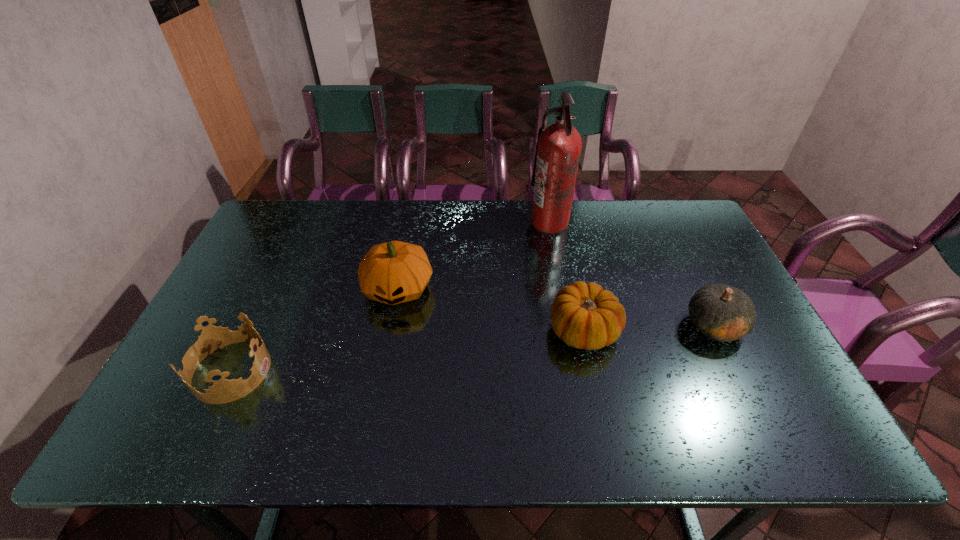
What are the coordinates of `free spot located 0.150m on the side of the leftmost gourd with the carved face` in the screenshot? It's located at (384, 361).

Find the location of `free location located on the front of the rightmost object`. free location located on the front of the rightmost object is located at coordinates (775, 448).

The width and height of the screenshot is (960, 540). I want to click on vacant space situated 0.270m on the front-facing side of the tiara, so click(x=377, y=371).

Identify the location of free space located 0.390m on the left of the second gourd from left to right. (404, 330).

The height and width of the screenshot is (540, 960). Find the location of `object located at the far edge`. object located at the far edge is located at coordinates click(x=558, y=149).

This screenshot has height=540, width=960. I want to click on object located at the left edge, so pyautogui.click(x=212, y=338).

What are the coordinates of `object positioned at the right edge` in the screenshot? It's located at (721, 312).

The height and width of the screenshot is (540, 960). I want to click on vacant space at the far edge of the desktop, so click(576, 232).

The height and width of the screenshot is (540, 960). In the image, there is a desktop. Identify the location of vacant space at the near edge. (605, 443).

In the image, there is a desktop. At what (x,y) coordinates should I click in order to perform the action: click on free region at the left edge. Please return your answer as a coordinate pair (x, y). The width and height of the screenshot is (960, 540). Looking at the image, I should click on (284, 253).